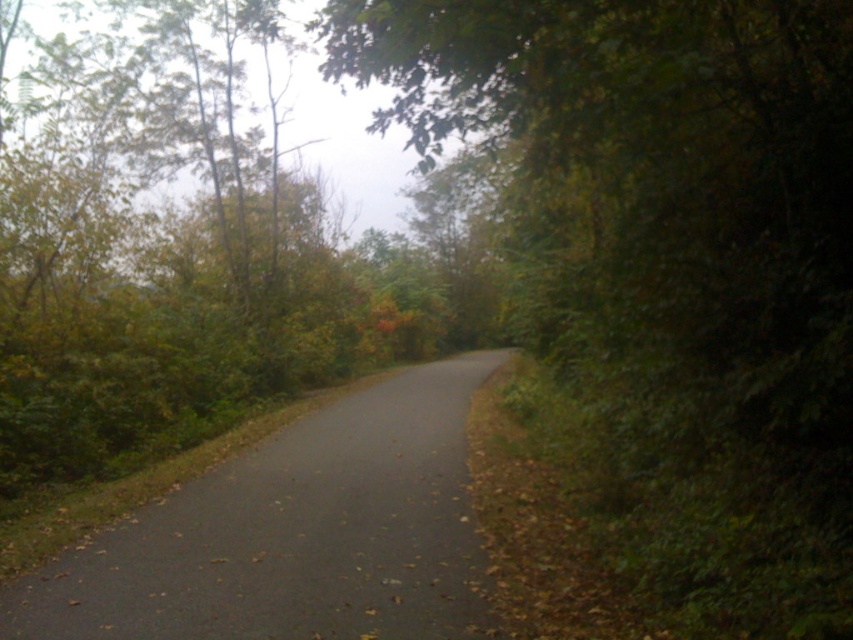
Based on the photo, between green leafy tree at center and black asphalt road at center, which one has more height?

green leafy tree at center is taller.

Based on the photo, between green leafy tree at center and black asphalt road at center, which one is positioned lower?

black asphalt road at center is below.

Is point (766, 307) positioned before point (259, 474)?

Yes, it is in front of point (259, 474).

Find the location of a particular element. green leafy tree at center is located at coordinates (670, 260).